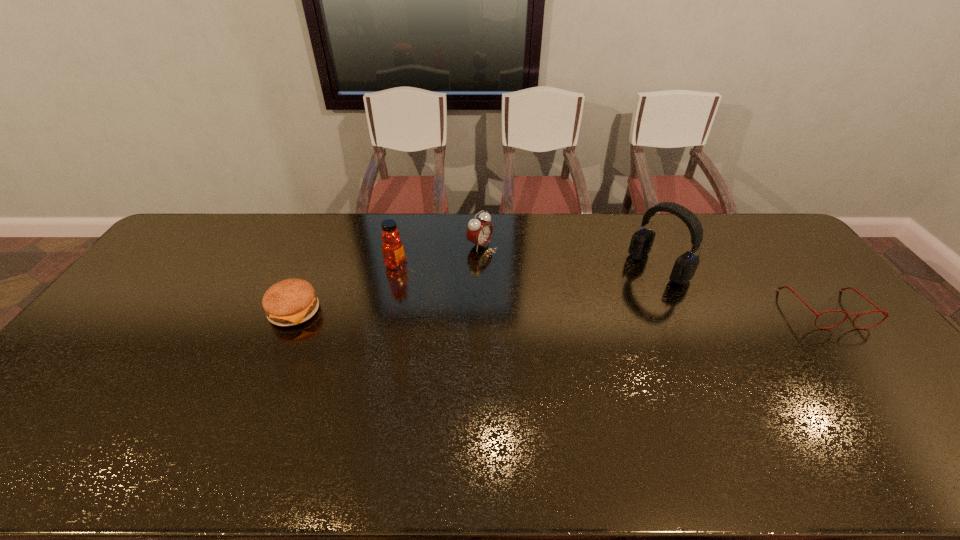
I want to click on headset that is positioned at the far edge, so click(685, 266).

Where is `alarm clock present at the far edge`? alarm clock present at the far edge is located at coordinates (479, 232).

Image resolution: width=960 pixels, height=540 pixels. I want to click on object that is positioned at the right edge, so click(885, 313).

Where is `free space at the far edge`? free space at the far edge is located at coordinates (336, 230).

In the image, there is a desktop. Identify the location of vacant area at the right edge. The width and height of the screenshot is (960, 540). (804, 306).

Image resolution: width=960 pixels, height=540 pixels. In order to click on free space at the far left corner of the desktop in this screenshot , I will do `click(195, 238)`.

Identify the location of vacant space at the far right corner of the desktop. (745, 241).

This screenshot has width=960, height=540. What are the coordinates of `blank region between the third object from left to right and the leftmost object` in the screenshot? It's located at (387, 278).

Where is `empty location between the third tallest object and the shortest object`? The width and height of the screenshot is (960, 540). empty location between the third tallest object and the shortest object is located at coordinates (653, 277).

Identify the location of vacant region between the tallest object and the second object from left to right. (527, 265).